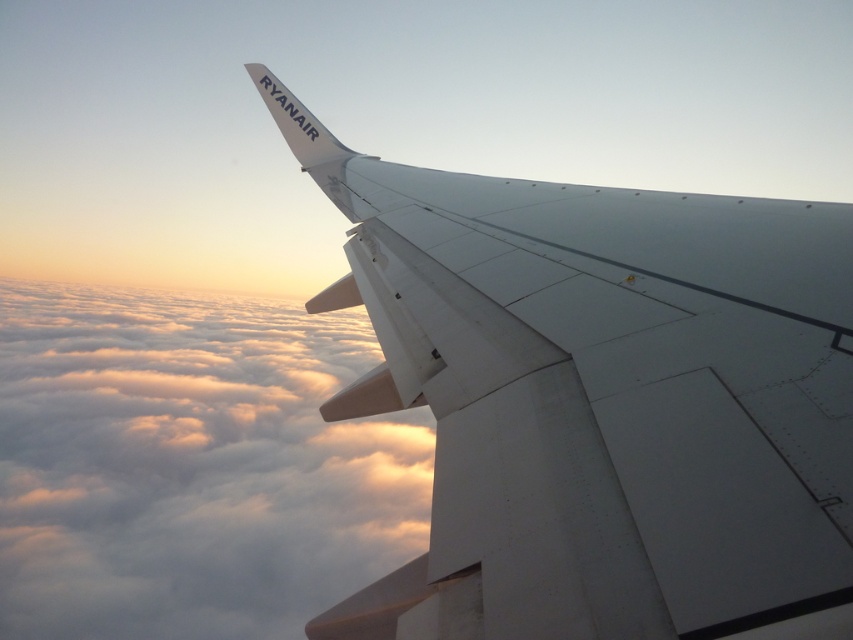
Question: Which point is farther from the camera taking this photo?

Choices:
 (A) pyautogui.click(x=590, y=608)
 (B) pyautogui.click(x=28, y=621)

Answer: (B)

Question: Which of the following is the farthest from the observer?

Choices:
 (A) white fluffy cloud at upper center
 (B) white matte wing at upper center

Answer: (A)

Question: Which point is farther from the camera taking this photo?

Choices:
 (A) (285, 493)
 (B) (701, 397)

Answer: (A)

Question: Is white matte wing at upper center behind white fluffy cloud at upper center?

Choices:
 (A) no
 (B) yes

Answer: (A)

Question: Is white matte wing at upper center below white fluffy cloud at upper center?

Choices:
 (A) no
 (B) yes

Answer: (A)

Question: From the image, what is the correct spatial relationship of white matte wing at upper center in relation to white fluffy cloud at upper center?

Choices:
 (A) below
 (B) above

Answer: (B)